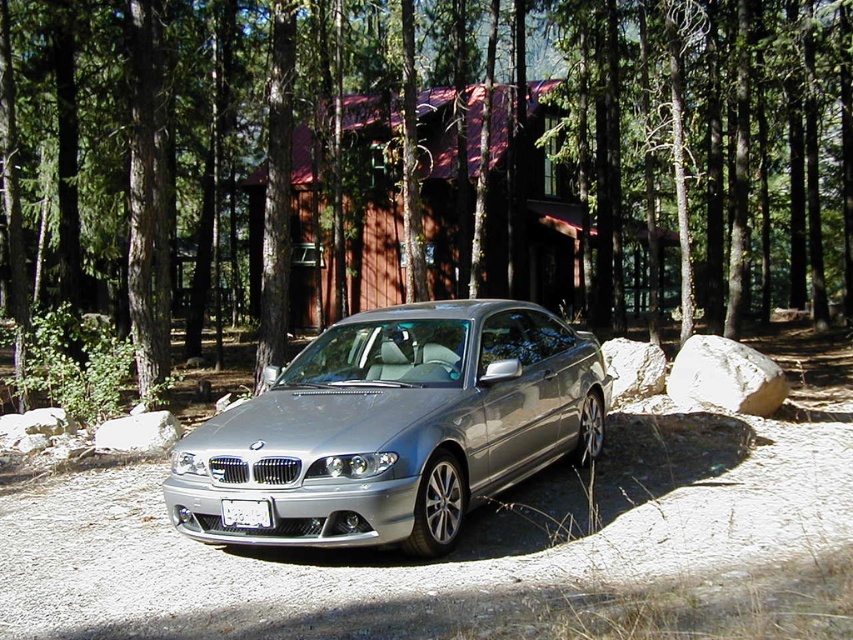
You are a delivery person trying to deliver a package to the cabin. You see the satin silver car at center and the white plastic license plate at center. Which object is closer to you?

The white plastic license plate at center is behind the satin silver car at center, so the satin silver car at center is closer to you.

You are a delivery person trying to locate the cabin in the forest. You see the green matte tree at center and the white plastic license plate at center. Which object is closer to the cabin?

The white plastic license plate at center is closer to the cabin because the green matte tree at center is positioned on the right side of it, meaning the license plate is between the tree and the cabin.

You are a photographer trying to capture the white plastic license plate at center of the silver BMW while ensuring the green matte tree at center is visible in the background. Can you position yourself in a way that both the license plate and the tree are in focus at the same time?

The green matte tree at center is further to the viewer than the white plastic license plate at center, so they are at different distances. This means it might be challenging to have both in focus simultaneously unless using a very small aperture or a lens with a large depth of field.